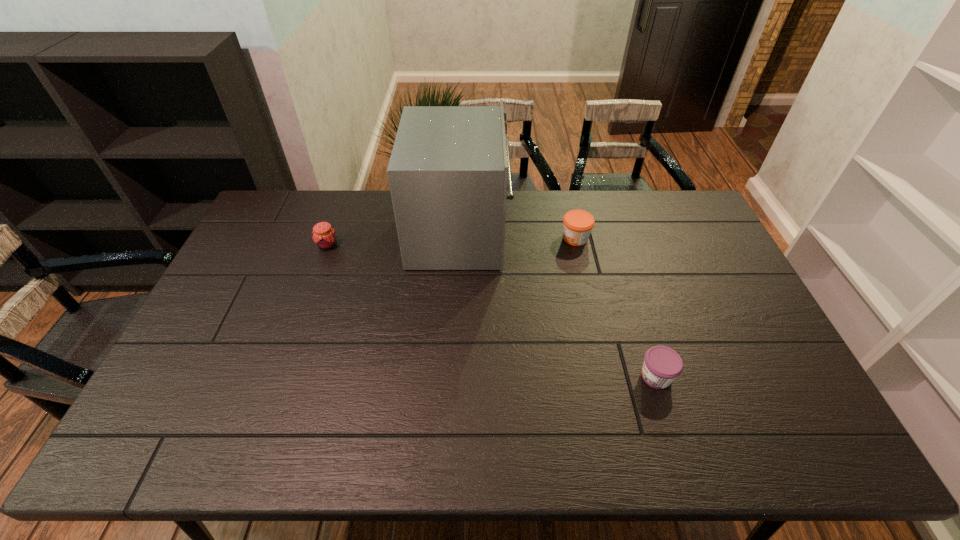
Where is `free space at the far right corner of the desktop`? free space at the far right corner of the desktop is located at coordinates (696, 220).

Where is `free area in between the nearest jam and the tallest object`? Image resolution: width=960 pixels, height=540 pixels. free area in between the nearest jam and the tallest object is located at coordinates (558, 305).

Image resolution: width=960 pixels, height=540 pixels. What are the coordinates of `unoccupied area between the leftmost jam and the rightmost object` in the screenshot? It's located at pyautogui.click(x=492, y=311).

Identify the location of free space between the third object from right to left and the leftmost jam. Image resolution: width=960 pixels, height=540 pixels. (394, 239).

Find the location of a particular element. Image resolution: width=960 pixels, height=540 pixels. vacant space in between the second jam from right to left and the rightmost jam is located at coordinates (615, 307).

Find the location of `empty location between the leftmost object and the rightmost jam`. empty location between the leftmost object and the rightmost jam is located at coordinates (492, 311).

This screenshot has height=540, width=960. I want to click on vacant area that lies between the leftmost jam and the nearest jam, so click(492, 311).

Select which object appears as the closest to the second jam from right to left. Please provide its 2D coordinates. Your answer should be formatted as a tuple, i.e. [(x, y)], where the tuple contains the x and y coordinates of a point satisfying the conditions above.

[(448, 170)]

Point out which object is positioned as the second nearest to the toaster oven. Please provide its 2D coordinates. Your answer should be formatted as a tuple, i.e. [(x, y)], where the tuple contains the x and y coordinates of a point satisfying the conditions above.

[(324, 236)]

Point out which jam is positioned as the third nearest to the toaster oven. Please provide its 2D coordinates. Your answer should be formatted as a tuple, i.e. [(x, y)], where the tuple contains the x and y coordinates of a point satisfying the conditions above.

[(662, 365)]